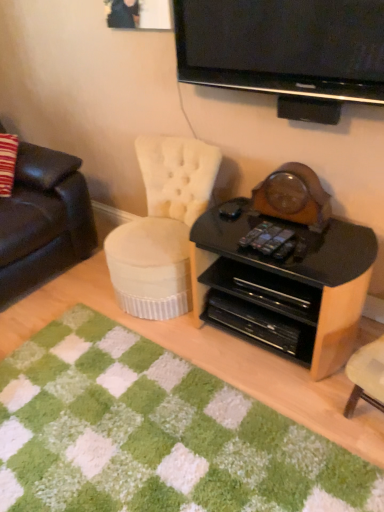
At what (x,y) coordinates should I click in order to perform the action: click on blank space situated above green shaggy rug at lower center (from a real-world perspective). Please return your answer as a coordinate pair (x, y). This screenshot has width=384, height=512. Looking at the image, I should click on (131, 425).